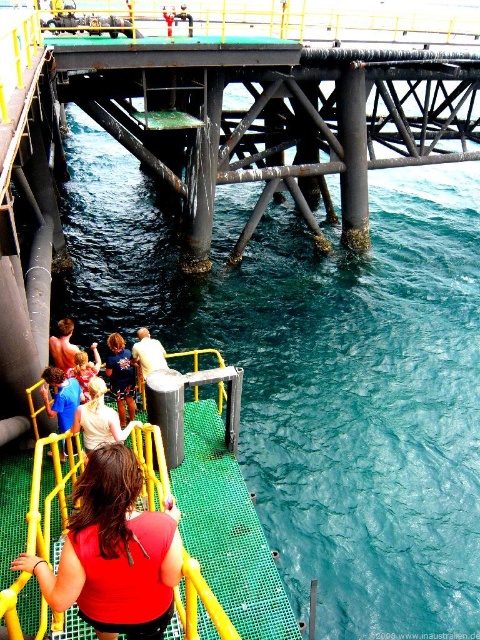
Between blue denim shorts at lower left and blue denim shirt at lower left, which one is positioned higher?

blue denim shorts at lower left

Is blue denim shorts at lower left smaller than blue denim shirt at lower left?

Actually, blue denim shorts at lower left might be larger than blue denim shirt at lower left.

Who is more distant from viewer, (112, 388) or (47, 385)?

The point (112, 388) is behind.

Find the location of a particular element. blue denim shorts at lower left is located at coordinates (120, 376).

Which is more to the left, red fabric shirt at lower center or blue denim shirt at lower left?

blue denim shirt at lower left is more to the left.

Which is in front, point (110, 596) or point (60, 419)?

Point (110, 596)

This screenshot has height=640, width=480. What do you see at coordinates (113, 552) in the screenshot?
I see `red fabric shirt at lower center` at bounding box center [113, 552].

At what (x,y) coordinates should I click in order to perform the action: click on red fabric shirt at lower center. Please return your answer as a coordinate pair (x, y). The width and height of the screenshot is (480, 640). Looking at the image, I should click on (113, 552).

Can you confirm if blonde hair at lower center is wider than light brown leather jacket at lower center?

Yes, blonde hair at lower center is wider than light brown leather jacket at lower center.

Can you confirm if blonde hair at lower center is bigger than light brown leather jacket at lower center?

Yes.

Between point (96, 380) and point (147, 356), which one is positioned in front?

Point (96, 380) is in front.

You are a GUI agent. You are given a task and a screenshot of the screen. Output one action in this format:
    pyautogui.click(x=<x>, y=<y>)
    Task: Click on the blonde hair at lower center
    This screenshot has height=640, width=480.
    Given the screenshot: What is the action you would take?
    98,419